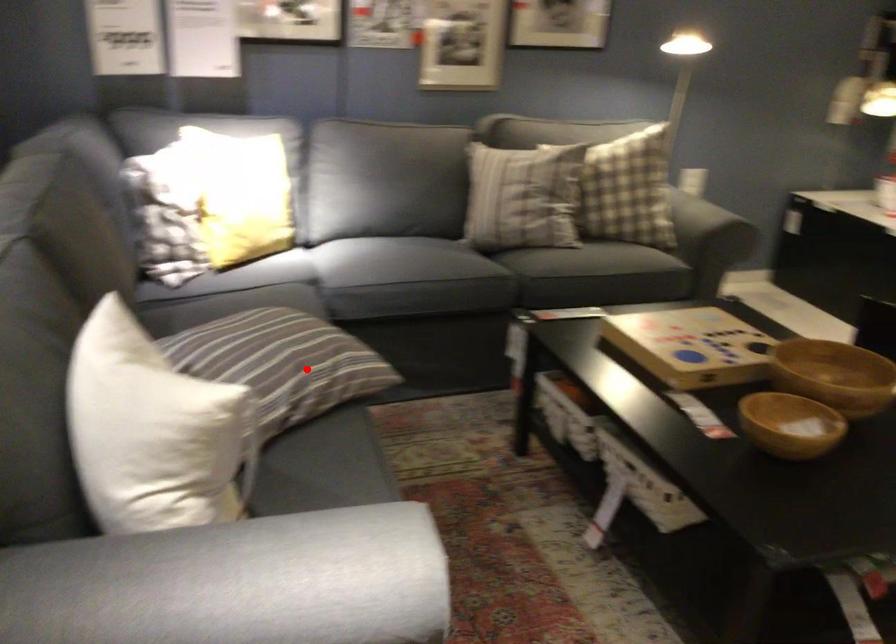
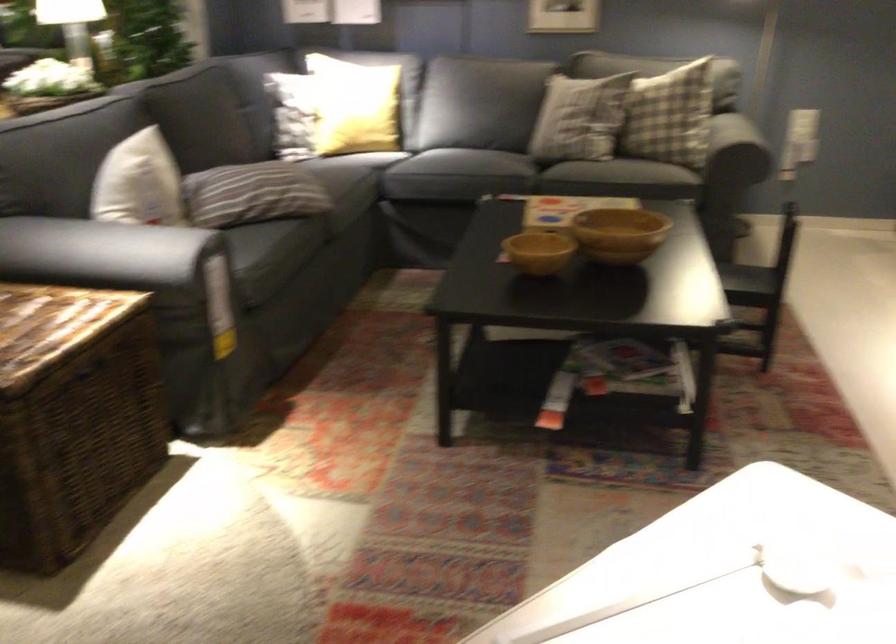
Question: I am providing you with two images of the same scene from different viewpoints. Given a red point in image1, look at the same physical point in image2. Is it:

Choices:
 (A) Closer to the viewpoint
 (B) Farther from the viewpoint

Answer: (B)